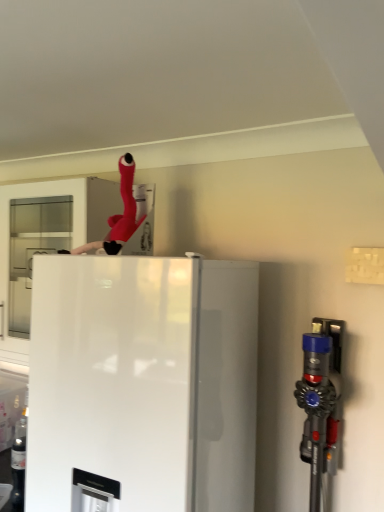
Question: From a real-world perspective, is white glossy refrigerator at center positioned over rubberized red hose at upper center based on gravity?

Choices:
 (A) yes
 (B) no

Answer: (B)

Question: Does white glossy refrigerator at center have a smaller size compared to rubberized red hose at upper center?

Choices:
 (A) yes
 (B) no

Answer: (B)

Question: Is white glossy refrigerator at center wider than rubberized red hose at upper center?

Choices:
 (A) no
 (B) yes

Answer: (B)

Question: Does white glossy refrigerator at center appear on the left side of rubberized red hose at upper center?

Choices:
 (A) yes
 (B) no

Answer: (B)

Question: Is white glossy refrigerator at center at the right side of rubberized red hose at upper center?

Choices:
 (A) no
 (B) yes

Answer: (B)

Question: Is the surface of white glossy refrigerator at center in direct contact with rubberized red hose at upper center?

Choices:
 (A) yes
 (B) no

Answer: (B)

Question: Is blue plastic vacuum cleaner at right bigger than white glossy refrigerator at center?

Choices:
 (A) no
 (B) yes

Answer: (A)

Question: Is blue plastic vacuum cleaner at right placed right next to white glossy refrigerator at center?

Choices:
 (A) no
 (B) yes

Answer: (A)

Question: Is blue plastic vacuum cleaner at right taller than white glossy refrigerator at center?

Choices:
 (A) no
 (B) yes

Answer: (A)

Question: From a real-world perspective, is blue plastic vacuum cleaner at right beneath white glossy refrigerator at center?

Choices:
 (A) no
 (B) yes

Answer: (B)

Question: Is blue plastic vacuum cleaner at right smaller than white glossy refrigerator at center?

Choices:
 (A) no
 (B) yes

Answer: (B)

Question: Is the depth of blue plastic vacuum cleaner at right less than that of white glossy refrigerator at center?

Choices:
 (A) yes
 (B) no

Answer: (B)

Question: Considering the relative sizes of blue plastic vacuum cleaner at right and rubberized red hose at upper center in the image provided, is blue plastic vacuum cleaner at right bigger than rubberized red hose at upper center?

Choices:
 (A) yes
 (B) no

Answer: (A)